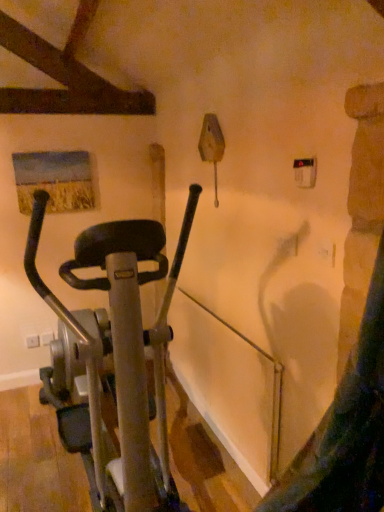
Question: Should I look upward or downward to see silver metallic stationary bicycle at left?

Choices:
 (A) up
 (B) down

Answer: (B)